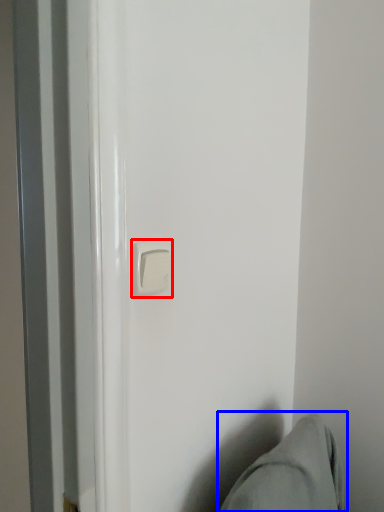
Question: Which object is closer to the camera taking this photo, door handle (highlighted by a red box) or swivel chair (highlighted by a blue box)?

Choices:
 (A) door handle
 (B) swivel chair

Answer: (B)